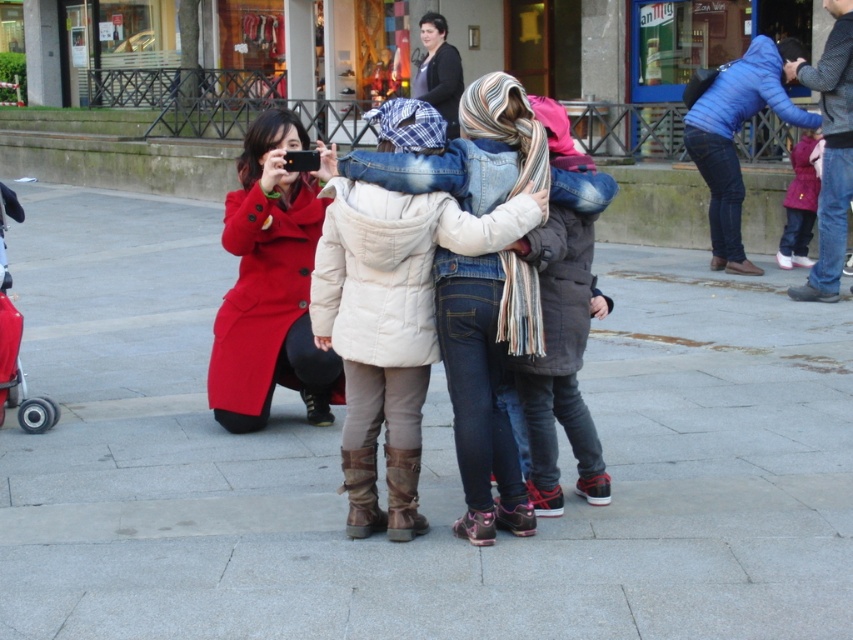
Question: Which object is closer to the camera taking this photo?

Choices:
 (A) matte red coat at center
 (B) gray concrete pavement at center

Answer: (B)

Question: Is white puffy coat at center below matte red coat at center?

Choices:
 (A) yes
 (B) no

Answer: (A)

Question: Is matte red coat at center below pink fleece jacket at upper right?

Choices:
 (A) no
 (B) yes

Answer: (B)

Question: Which of the following is the farthest from the observer?

Choices:
 (A) (735, 118)
 (B) (26, 477)

Answer: (A)

Question: Is gray concrete pavement at center to the right of pink fleece jacket at upper right from the viewer's perspective?

Choices:
 (A) yes
 (B) no

Answer: (B)

Question: Which is farther from the matte black jacket at upper center?

Choices:
 (A) white puffy coat at center
 (B) matte red coat at center
 (C) blue denim jeans at upper right
 (D) pink fleece jacket at upper right

Answer: (A)